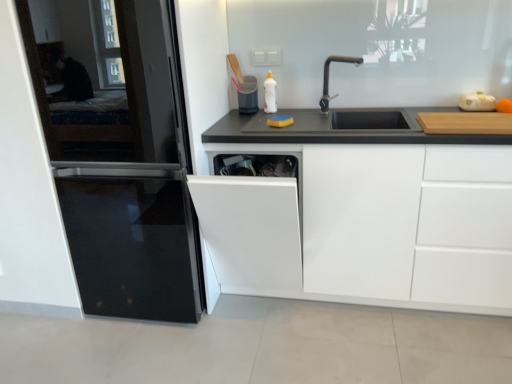
Question: From the image's perspective, relative to white glossy dishwasher at center, is white glossy bottle at upper center above or below?

Choices:
 (A) above
 (B) below

Answer: (A)

Question: From a real-world perspective, is white glossy bottle at upper center positioned above or below white glossy dishwasher at center?

Choices:
 (A) above
 (B) below

Answer: (A)

Question: Which of these objects is positioned closest to the white matte cabinet at center?

Choices:
 (A) white glossy dishwasher at center
 (B) white glossy bottle at upper center
 (C) matte plastic trash can at center, the second appliance from the front
 (D) black metallic faucet at upper center
 (E) black glass refrigerator at left

Answer: (A)

Question: Based on their relative distances, which object is farther from the wooden cutting board at right?

Choices:
 (A) matte plastic trash can at center, which is the 1th appliance in left-to-right order
 (B) black glass refrigerator at left
 (C) white matte cabinet at center
 (D) white glossy bottle at upper center
 (E) white glossy dishwasher at center

Answer: (B)